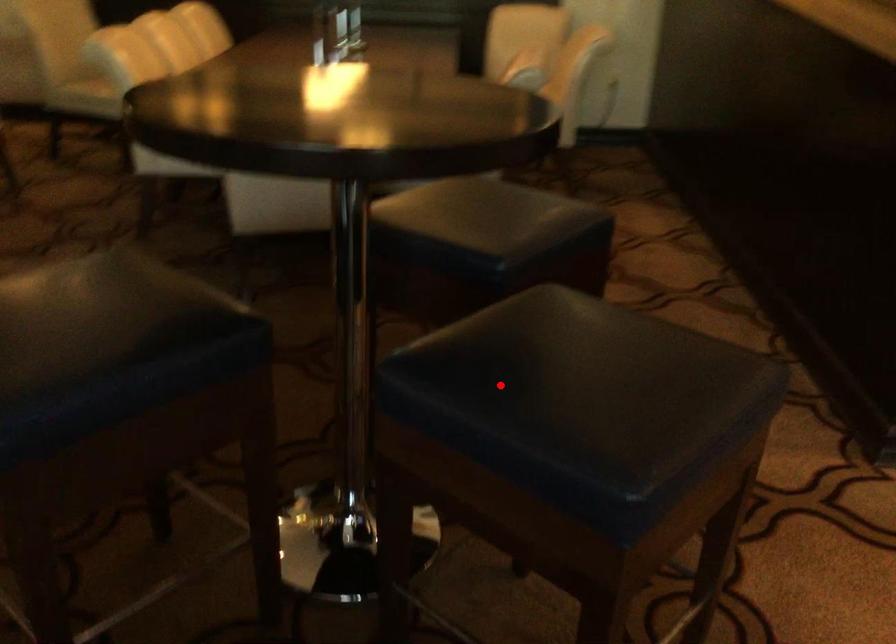
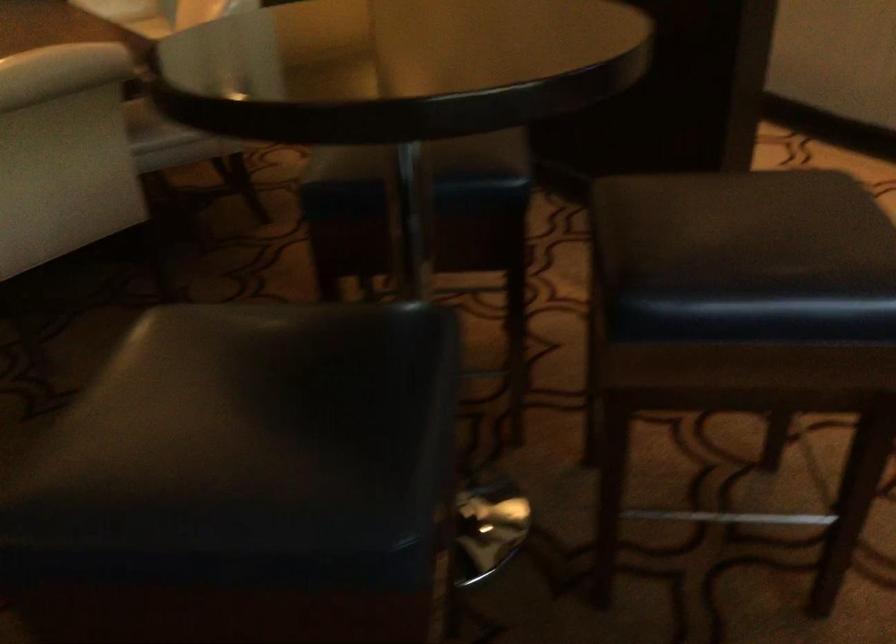
Locate, in the second image, the point that corresponds to the highlighted location in the first image.

(745, 257)